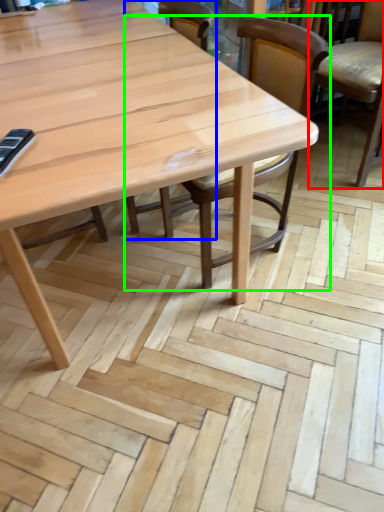
Question: Which is farther away from chair (highlighted by a red box)? chair (highlighted by a blue box) or chair (highlighted by a green box)?

Choices:
 (A) chair
 (B) chair

Answer: (A)